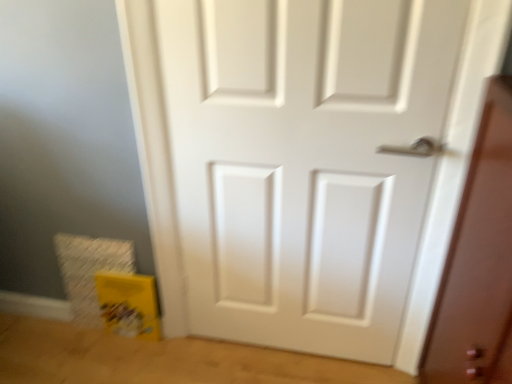
Question: Is matte white door at right bigger than white matte door at center?

Choices:
 (A) yes
 (B) no

Answer: (A)

Question: Is white matte door at center completely or partially inside matte white door at right?

Choices:
 (A) yes
 (B) no

Answer: (B)

Question: Is matte white door at right at the left side of white matte door at center?

Choices:
 (A) yes
 (B) no

Answer: (B)

Question: Is matte white door at right shorter than white matte door at center?

Choices:
 (A) no
 (B) yes

Answer: (B)

Question: Is matte white door at right looking in the opposite direction of white matte door at center?

Choices:
 (A) no
 (B) yes

Answer: (A)

Question: From a real-world perspective, does matte white door at right stand above white matte door at center?

Choices:
 (A) no
 (B) yes

Answer: (A)

Question: Can you confirm if white matte door at center is thinner than matte white door at right?

Choices:
 (A) no
 (B) yes

Answer: (B)

Question: Considering the relative positions of white matte door at center and matte white door at right in the image provided, is white matte door at center behind matte white door at right?

Choices:
 (A) yes
 (B) no

Answer: (A)

Question: Would you consider white matte door at center to be distant from matte white door at right?

Choices:
 (A) no
 (B) yes

Answer: (A)

Question: From the image's perspective, is white matte door at center below matte white door at right?

Choices:
 (A) yes
 (B) no

Answer: (B)

Question: Does white matte door at center lie in front of matte white door at right?

Choices:
 (A) yes
 (B) no

Answer: (B)

Question: Does white matte door at center have a greater width compared to matte white door at right?

Choices:
 (A) yes
 (B) no

Answer: (B)

Question: In the image, is white matte door at center on the left side or the right side of matte white door at right?

Choices:
 (A) left
 (B) right

Answer: (A)